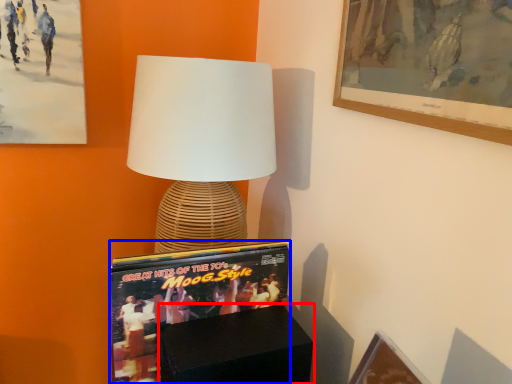
Question: Which object appears farthest to the camera in this image, furniture (highlighted by a red box) or magazine (highlighted by a blue box)?

Choices:
 (A) furniture
 (B) magazine

Answer: (B)